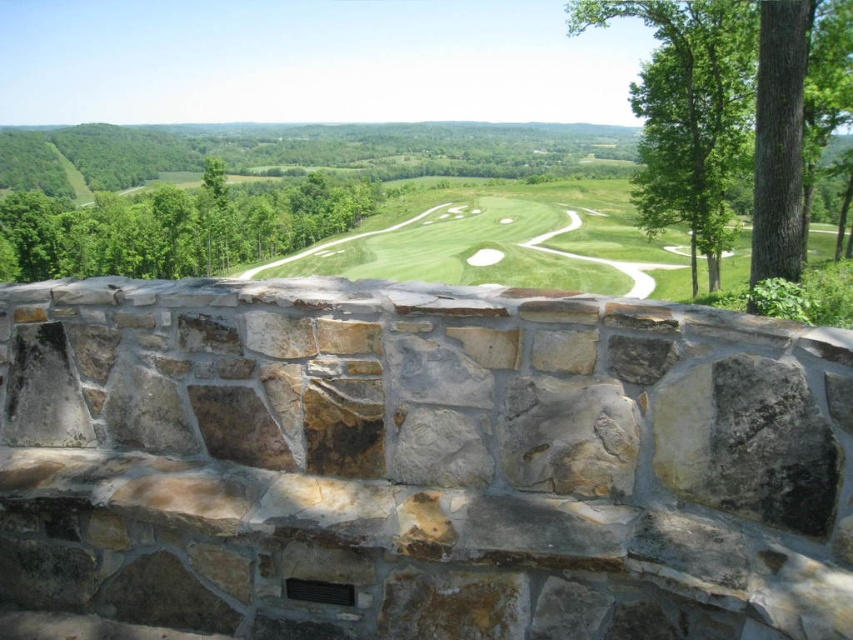
You are a golfer standing on the stone overlook. You want to hit a ball from the green leafy tree at right to the green grassy golf course at center. Which object will require more space to accommodate your swing?

The green grassy golf course at center requires more space to accommodate your swing since it occupies more space than the green leafy tree at right.

You are standing on the stone overlook and want to take a photo of the green grassy golf course at center. There is a green leafy tree at right in the way. Which direction should you move to avoid the tree blocking the view?

You should move to the right to avoid the green leafy tree at right blocking the view of the green grassy golf course at center since the tree is positioned to the left of the golf course.